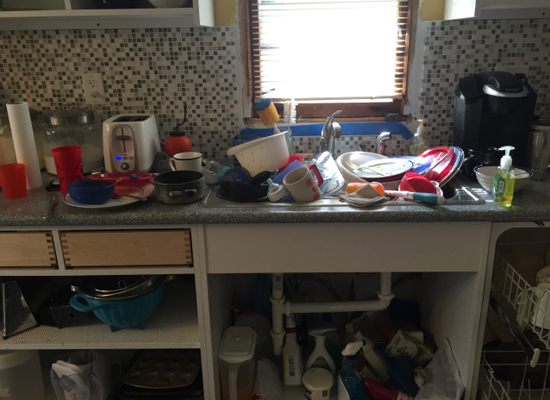
Find the location of `cup`. cup is located at coordinates (16, 179), (69, 161), (184, 161), (302, 191), (238, 138).